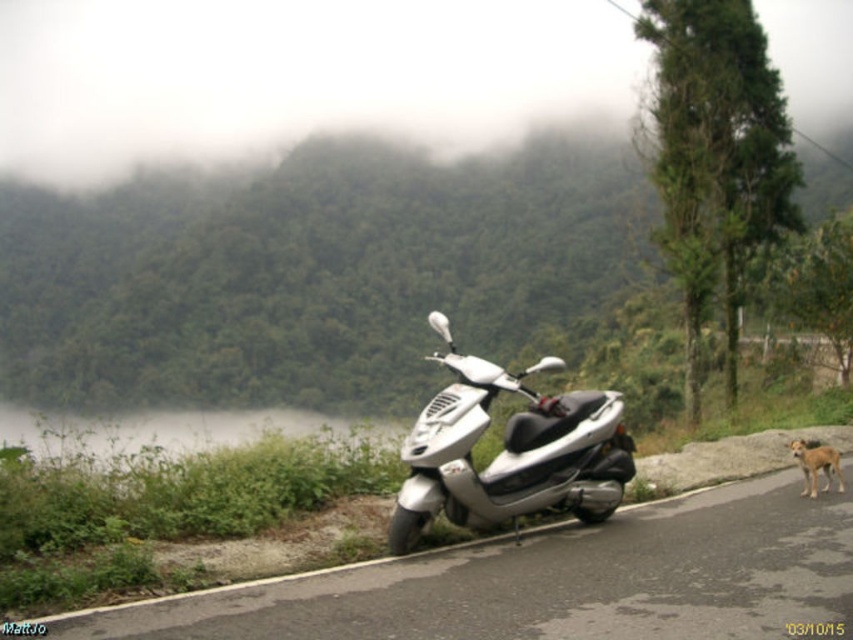
Question: Can you confirm if metallic silver scooter at center is thinner than brown fur dog at lower right?

Choices:
 (A) yes
 (B) no

Answer: (B)

Question: Can you confirm if metallic silver scooter at center is positioned below silver metallic scooter at center?

Choices:
 (A) no
 (B) yes

Answer: (B)

Question: Does metallic silver scooter at center have a greater width compared to silver metallic scooter at center?

Choices:
 (A) no
 (B) yes

Answer: (A)

Question: Which object appears farthest from the camera in this image?

Choices:
 (A) brown fur dog at lower right
 (B) silver metallic scooter at center

Answer: (A)

Question: Which of the following is the farthest from the observer?

Choices:
 (A) brown fur dog at lower right
 (B) metallic silver scooter at center

Answer: (A)

Question: Which of the following is the closest to the observer?

Choices:
 (A) metallic silver scooter at center
 (B) brown fur dog at lower right
 (C) silver metallic scooter at center

Answer: (A)